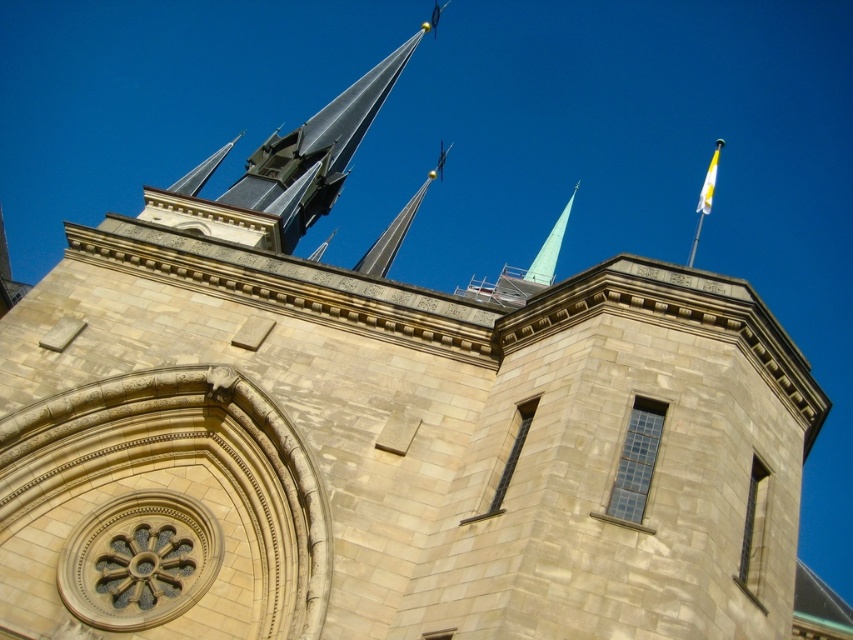
Can you confirm if shiny metallic spire at center is bigger than yellow fabric flag at upper right?

Correct, shiny metallic spire at center is larger in size than yellow fabric flag at upper right.

What do you see at coordinates (397, 227) in the screenshot? I see `shiny metallic spire at center` at bounding box center [397, 227].

Find the location of a particular element. The width and height of the screenshot is (853, 640). shiny metallic spire at center is located at coordinates (397, 227).

Find the location of `shiny metallic spire at center`. shiny metallic spire at center is located at coordinates (397, 227).

Is light blue glass spire at upper center bigger than yellow fabric flag at upper right?

Correct, light blue glass spire at upper center is larger in size than yellow fabric flag at upper right.

Who is lower down, light blue glass spire at upper center or yellow fabric flag at upper right?

light blue glass spire at upper center is below.

Locate an element on the screen. light blue glass spire at upper center is located at coordinates (549, 248).

Identify the location of light blue glass spire at upper center. This screenshot has height=640, width=853. (549, 248).

In the scene shown: Does shiny metallic spire at center have a greater width compared to light blue glass spire at upper center?

No.

Which is behind, point (415, 195) or point (521, 276)?

Positioned behind is point (415, 195).

In order to click on shiny metallic spire at center in this screenshot , I will do `click(397, 227)`.